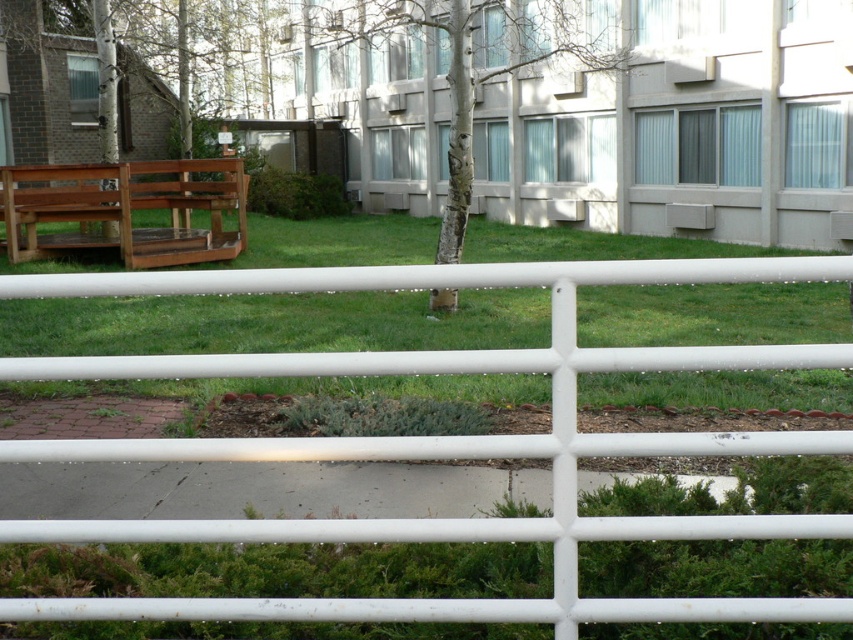
You are a gardener planning to mow the green grass at center and trim the smooth bark tree at center. Which task would require more time due to the size difference between the two?

The smooth bark tree at center would require more time to trim because it occupies more space than the green grass at center.